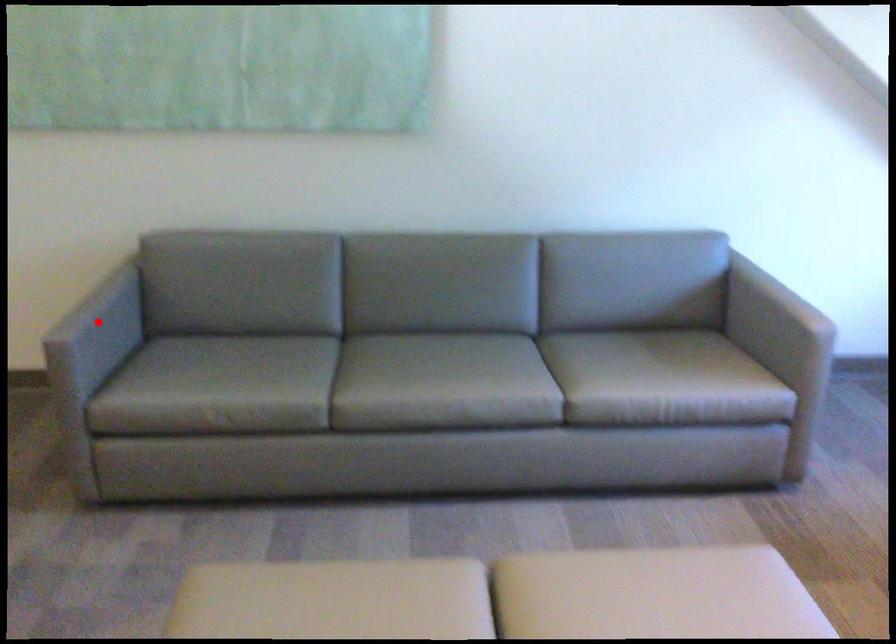
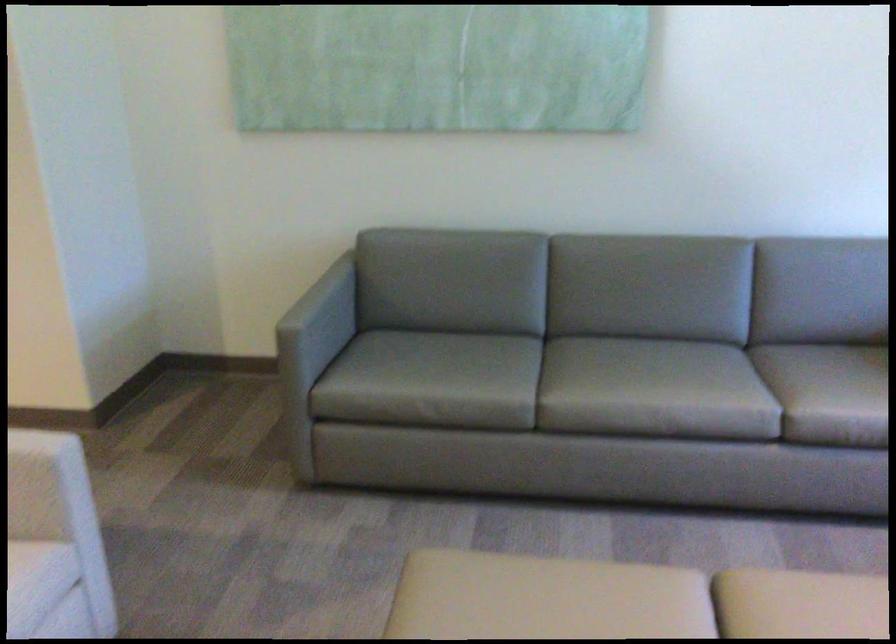
Where in the second image is the point corresponding to the highlighted location from the first image?

(321, 313)